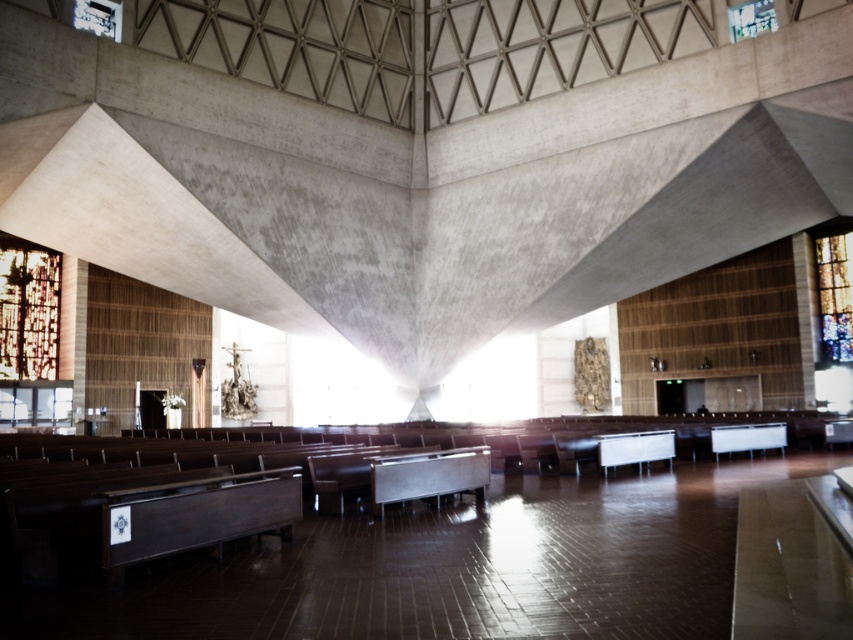
Based on the photo, does stained glass window at left appear on the left side of stained glass window at right?

Yes, stained glass window at left is to the left of stained glass window at right.

Is stained glass window at left smaller than stained glass window at right?

No, stained glass window at left is not smaller than stained glass window at right.

Which is in front, point (57, 316) or point (834, 304)?

Positioned in front is point (57, 316).

Where is `stained glass window at left`? This screenshot has height=640, width=853. stained glass window at left is located at coordinates (28, 308).